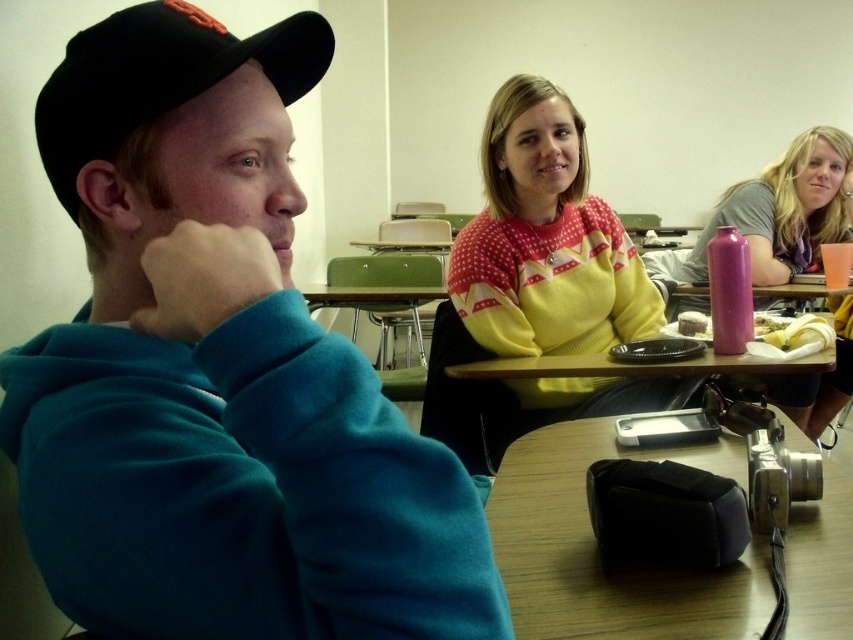
Is yellow sweater at center positioned in front of black fabric camera at lower right?

No, yellow sweater at center is behind black fabric camera at lower right.

Does point (509, 192) lie in front of point (697, 632)?

No, (509, 192) is further to viewer.

Does point (579, 195) come behind point (786, 435)?

That is True.

Where is `yellow sweater at center`? The height and width of the screenshot is (640, 853). yellow sweater at center is located at coordinates (535, 284).

How distant is black fabric camera at lower right from black fabric baseball cap at left?

The distance of black fabric camera at lower right from black fabric baseball cap at left is 25.67 inches.

Can you confirm if black fabric camera at lower right is positioned below black fabric baseball cap at left?

Yes.

The image size is (853, 640). What do you see at coordinates (595, 548) in the screenshot?
I see `black fabric camera at lower right` at bounding box center [595, 548].

Locate an element on the screen. The image size is (853, 640). black fabric camera at lower right is located at coordinates (595, 548).

Does teal fleece jacket at center come in front of yellow sweater at center?

That is True.

Image resolution: width=853 pixels, height=640 pixels. Describe the element at coordinates (218, 372) in the screenshot. I see `teal fleece jacket at center` at that location.

I want to click on teal fleece jacket at center, so click(218, 372).